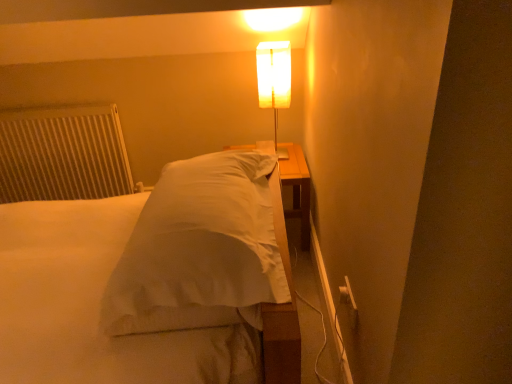
Question: Should I look upward or downward to see translucent white lamp at upper center?

Choices:
 (A) up
 (B) down

Answer: (A)

Question: Considering the relative sizes of translucent white lamp at upper center and white textured radiator at left in the image provided, is translucent white lamp at upper center wider than white textured radiator at left?

Choices:
 (A) no
 (B) yes

Answer: (B)

Question: Is translucent white lamp at upper center shorter than white textured radiator at left?

Choices:
 (A) no
 (B) yes

Answer: (B)

Question: Is translucent white lamp at upper center facing away from white textured radiator at left?

Choices:
 (A) yes
 (B) no

Answer: (B)

Question: Can you confirm if translucent white lamp at upper center is taller than white textured radiator at left?

Choices:
 (A) yes
 (B) no

Answer: (B)

Question: Is translucent white lamp at upper center directly adjacent to white textured radiator at left?

Choices:
 (A) no
 (B) yes

Answer: (A)

Question: Is white textured radiator at left surrounded by translucent white lamp at upper center?

Choices:
 (A) no
 (B) yes

Answer: (A)

Question: Would you consider white satin bed at center to be distant from white textured radiator at left?

Choices:
 (A) yes
 (B) no

Answer: (A)

Question: From a real-world perspective, is white satin bed at center on white textured radiator at left?

Choices:
 (A) yes
 (B) no

Answer: (A)

Question: Considering the relative sizes of white satin bed at center and white textured radiator at left in the image provided, is white satin bed at center bigger than white textured radiator at left?

Choices:
 (A) yes
 (B) no

Answer: (A)

Question: From the image's perspective, is white satin bed at center below white textured radiator at left?

Choices:
 (A) no
 (B) yes

Answer: (B)

Question: Can we say white satin bed at center lies outside white textured radiator at left?

Choices:
 (A) no
 (B) yes

Answer: (B)

Question: Does white satin bed at center come behind white textured radiator at left?

Choices:
 (A) yes
 (B) no

Answer: (B)

Question: From the image's perspective, would you say white satin bed at center is positioned over translucent white lamp at upper center?

Choices:
 (A) no
 (B) yes

Answer: (A)